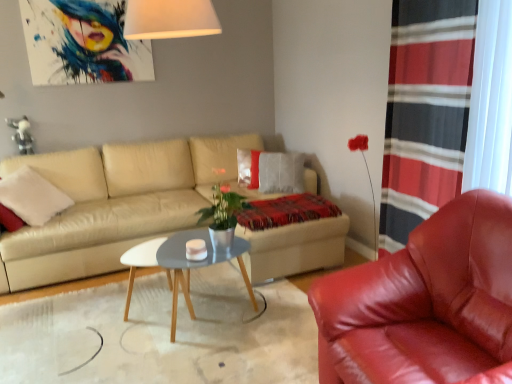
Locate an element on the screen. The width and height of the screenshot is (512, 384). free space to the left of gray wooden coffee table at center is located at coordinates (97, 308).